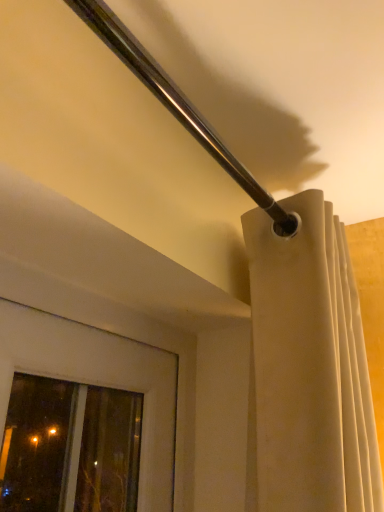
Describe the element at coordinates (177, 104) in the screenshot. The image size is (384, 512). I see `polished metal rod at upper center` at that location.

Find the location of a particular element. polished metal rod at upper center is located at coordinates (177, 104).

Measure the distance between point [263,203] and camera.

31.46 inches.

Locate an element on the screen. This screenshot has height=512, width=384. polished metal rod at upper center is located at coordinates (177, 104).